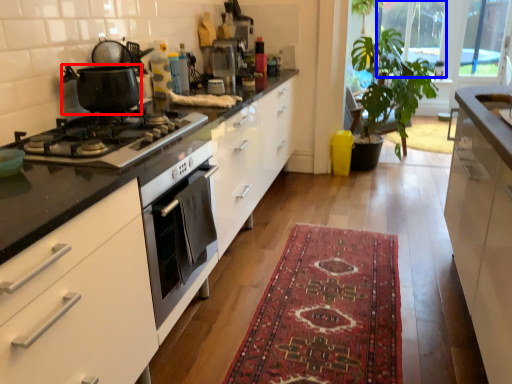
Question: Which object is closer to the camera taking this photo, kitchen appliance (highlighted by a red box) or window screen (highlighted by a blue box)?

Choices:
 (A) kitchen appliance
 (B) window screen

Answer: (A)